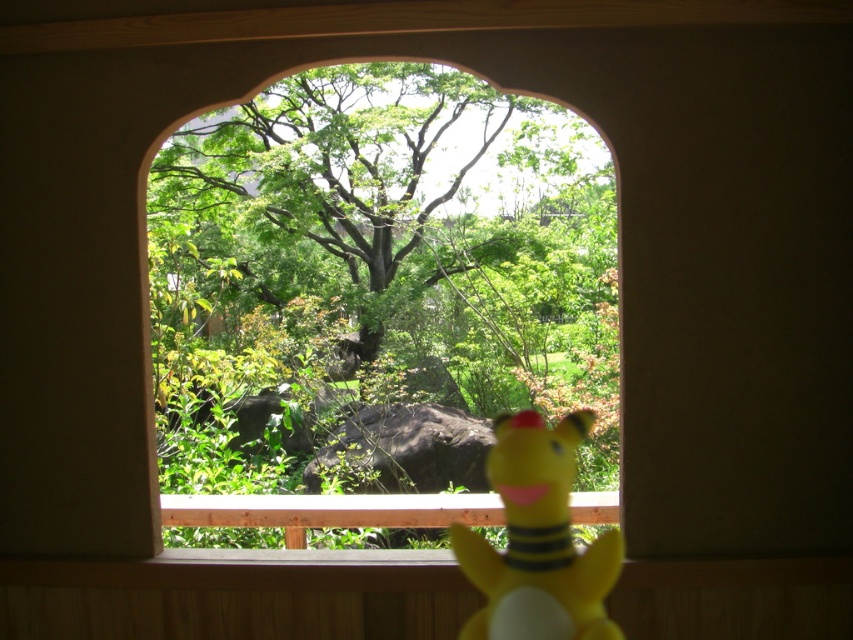
Question: Which object is closer to the camera taking this photo?

Choices:
 (A) yellow rubber duck at lower right
 (B) green matte window at center

Answer: (A)

Question: Which point appears farthest from the camera in this image?

Choices:
 (A) (376, 378)
 (B) (451, 541)

Answer: (A)

Question: Is green matte window at center to the right of yellow rubber duck at lower right from the viewer's perspective?

Choices:
 (A) no
 (B) yes

Answer: (A)

Question: Is green matte window at center closer to the viewer compared to yellow rubber duck at lower right?

Choices:
 (A) yes
 (B) no

Answer: (B)

Question: Does green matte window at center have a greater width compared to yellow rubber duck at lower right?

Choices:
 (A) no
 (B) yes

Answer: (A)